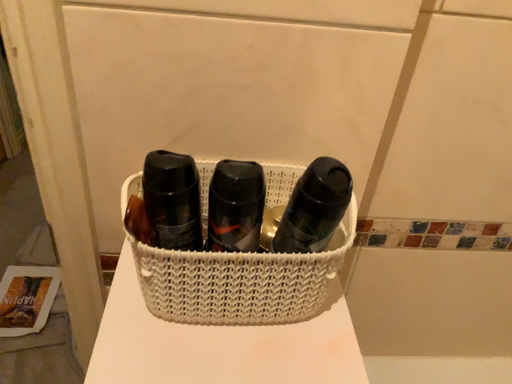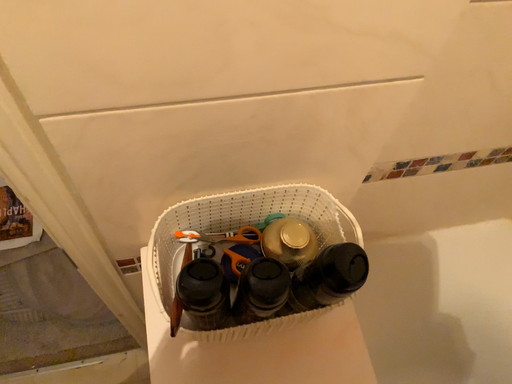
Question: How did the camera likely rotate when shooting the video?

Choices:
 (A) rotated right
 (B) rotated left

Answer: (A)